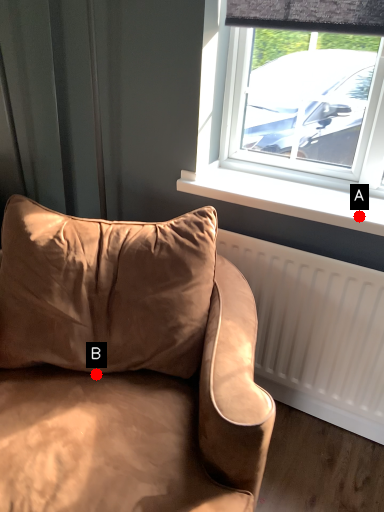
Question: Two points are circled on the image, labeled by A and B beside each circle. Among these points, which one is nearest to the camera?

Choices:
 (A) A is closer
 (B) B is closer

Answer: (B)